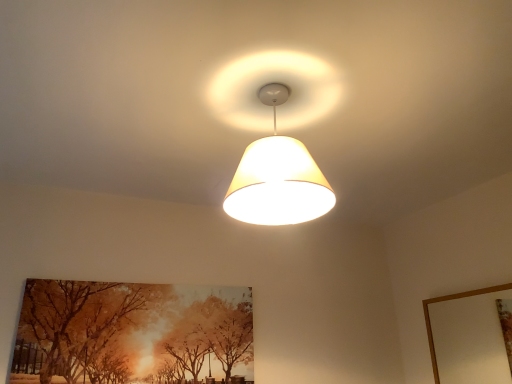
Question: Is point (426, 319) closer or farther from the camera than point (66, 332)?

Choices:
 (A) closer
 (B) farther

Answer: (B)

Question: Is wooden picture frame at upper right bigger or smaller than orange painted canvas at lower left?

Choices:
 (A) big
 (B) small

Answer: (B)

Question: Which of these objects is positioned farthest from the wooden picture frame at upper right?

Choices:
 (A) matte white lampshade at center
 (B) orange painted canvas at lower left

Answer: (B)

Question: Estimate the real-world distances between objects in this image. Which object is farther from the orange painted canvas at lower left?

Choices:
 (A) matte white lampshade at center
 (B) wooden picture frame at upper right

Answer: (B)